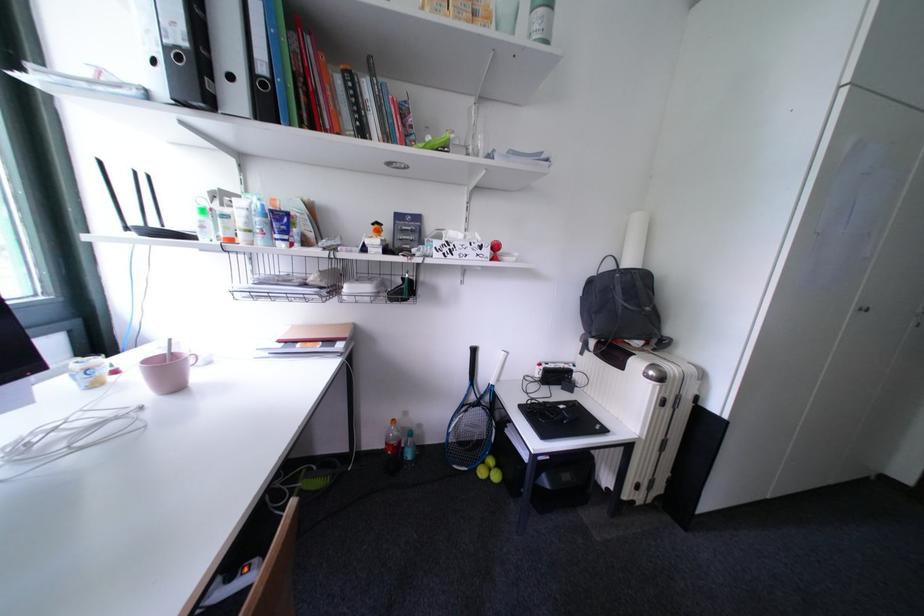
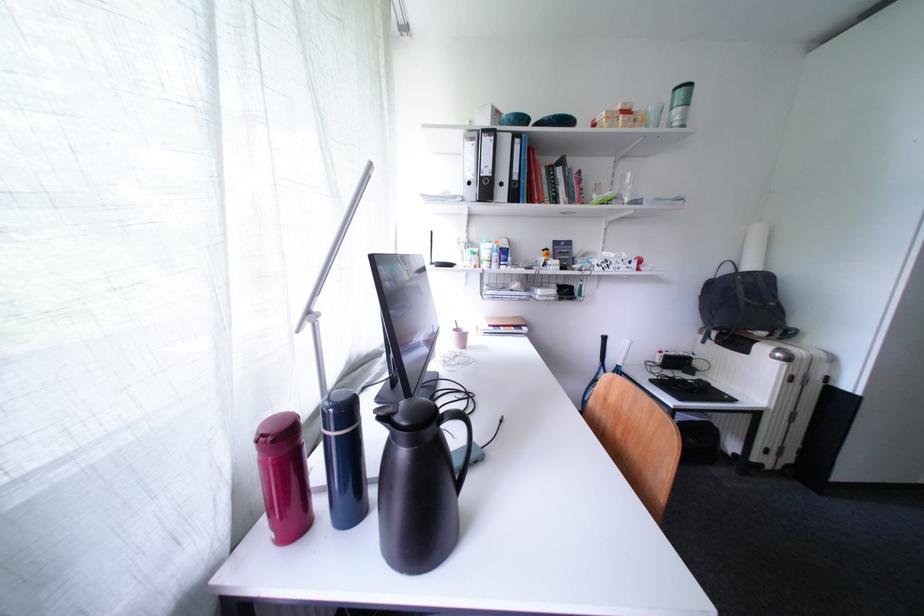
Question: The first image is from the beginning of the video and the second image is from the end. How did the camera likely rotate when shooting the video?

Choices:
 (A) Left
 (B) Right
 (C) Up
 (D) Down

Answer: (A)